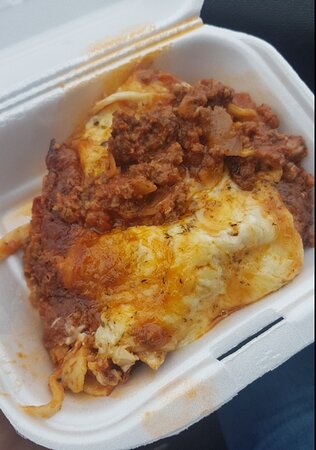
Where is `plate cover`? Image resolution: width=316 pixels, height=450 pixels. plate cover is located at coordinates (46, 14).